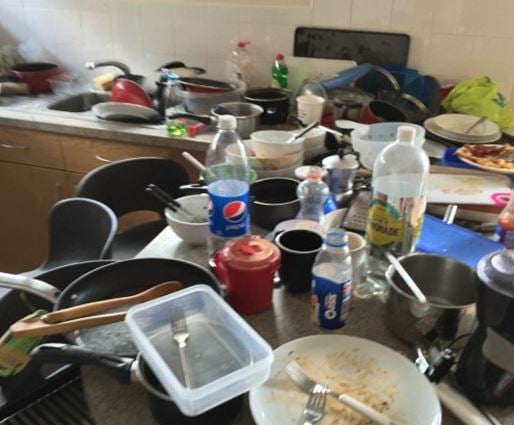
What are the coordinates of `cutting board` in the screenshot? It's located at (461, 195).